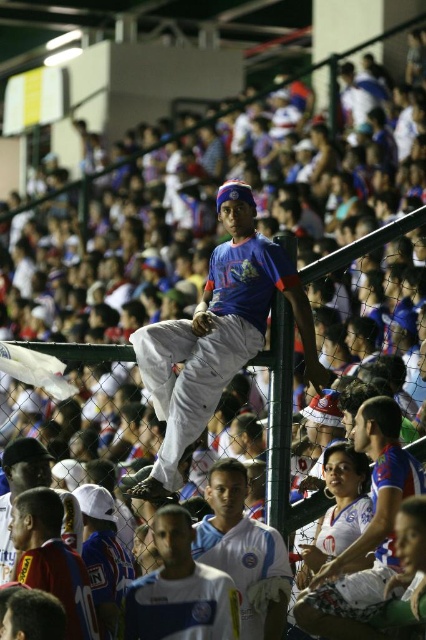
Is matte blue shirt at center bigger than white jersey at lower left?

Yes, matte blue shirt at center is bigger than white jersey at lower left.

Is point (172, 365) more distant than point (42, 508)?

Yes, point (172, 365) is behind point (42, 508).

This screenshot has width=426, height=640. I want to click on matte blue shirt at center, so click(218, 333).

Who is taller, white jersey at center or white jersey at lower left?

white jersey at lower left is taller.

Is white jersey at center shorter than white jersey at lower left?

Correct, white jersey at center is not as tall as white jersey at lower left.

Is point (147, 637) closer to camera compared to point (48, 536)?

Yes, it is in front of point (48, 536).

The height and width of the screenshot is (640, 426). Find the location of `white jersey at center`. white jersey at center is located at coordinates (180, 589).

Is matte blue shirt at center to the right of white jersey at center from the viewer's perspective?

Indeed, matte blue shirt at center is positioned on the right side of white jersey at center.

Who is more distant from viewer, (x=181, y=324) or (x=199, y=609)?

The point (x=181, y=324) is more distant.

Find the location of `matte blue shirt at center`. matte blue shirt at center is located at coordinates (218, 333).